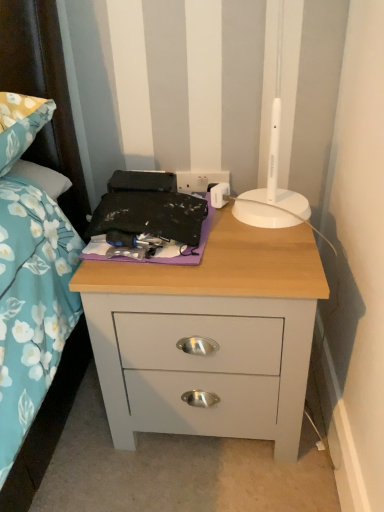
Question: Is white plastic electric outlet at upper center spatially inside matte gray nightstand at center, or outside of it?

Choices:
 (A) outside
 (B) inside

Answer: (A)

Question: From the image's perspective, is white plastic electric outlet at upper center located above or below matte gray nightstand at center?

Choices:
 (A) below
 (B) above

Answer: (B)

Question: Based on their relative distances, which object is farther from the matte gray nightstand at center?

Choices:
 (A) white plastic electric outlet at upper center
 (B) purple fabric at center

Answer: (A)

Question: Which of these objects is positioned farthest from the purple fabric at center?

Choices:
 (A) matte gray nightstand at center
 (B) white plastic electric outlet at upper center

Answer: (B)